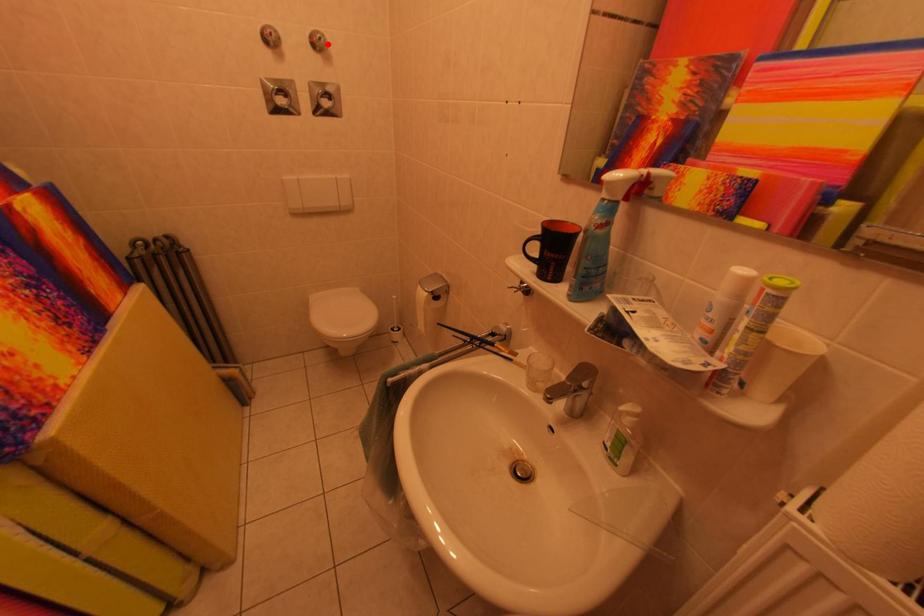
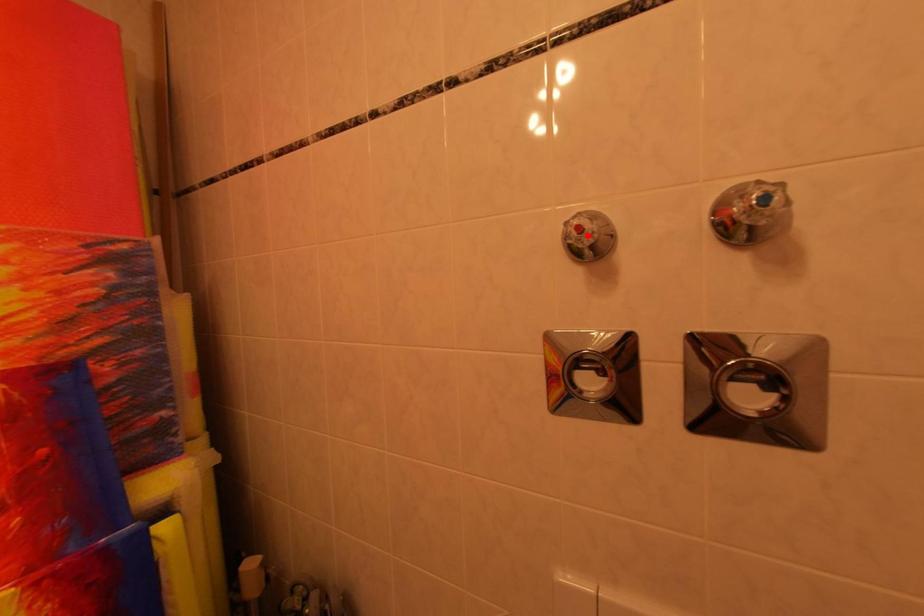
I am providing you with two images of the same scene from different viewpoints. A red point is marked on the first image and another point is marked on the second image. Do the highlighted points in image1 and image2 indicate the same real-world spot?

No